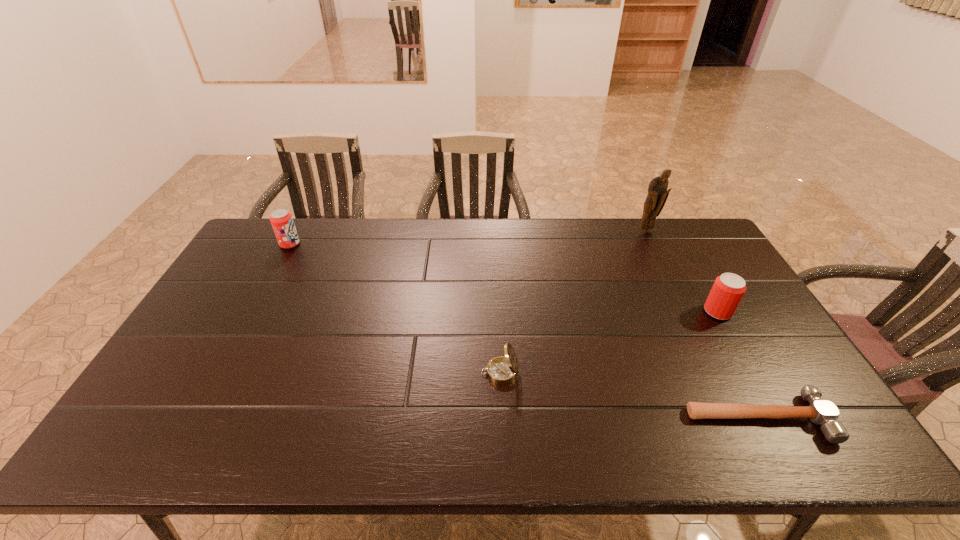
At what (x,y) coordinates should I click in order to perform the action: click on the tallest object. Please return your answer as a coordinate pair (x, y). Looking at the image, I should click on (657, 195).

This screenshot has height=540, width=960. I want to click on figurine, so click(657, 195).

The height and width of the screenshot is (540, 960). I want to click on the leftmost object, so click(281, 220).

Where is `soda can`? Image resolution: width=960 pixels, height=540 pixels. soda can is located at coordinates (281, 220).

The width and height of the screenshot is (960, 540). What are the coordinates of `the third farthest object` in the screenshot? It's located at (728, 289).

Locate an element on the screen. the fourth tallest object is located at coordinates (501, 370).

You are a GUI agent. You are given a task and a screenshot of the screen. Output one action in this format:
    pyautogui.click(x=<x>, y=<y>)
    Task: Click on the fourth object from right to left
    This screenshot has height=540, width=960.
    Given the screenshot: What is the action you would take?
    pyautogui.click(x=501, y=370)

Locate an element on the screen. hammer is located at coordinates (820, 412).

Identify the location of the shortest object. The width and height of the screenshot is (960, 540). (820, 412).

Identify the location of vacant space located on the front-facing side of the tallest object. Image resolution: width=960 pixels, height=540 pixels. click(657, 253).